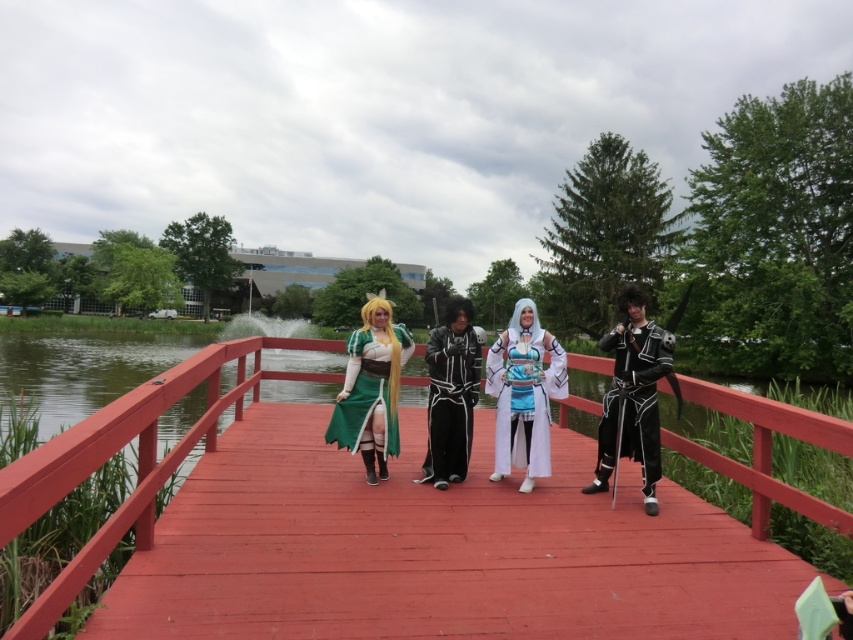
Is white glossy kimono at center taller than black satin robe at center?

Yes.

Describe the element at coordinates (523, 394) in the screenshot. I see `white glossy kimono at center` at that location.

Which is behind, point (519, 374) or point (451, 413)?

The point (451, 413) is more distant.

Image resolution: width=853 pixels, height=640 pixels. I want to click on white glossy kimono at center, so click(x=523, y=394).

Does point (579, 636) come behind point (517, 355)?

No, it is in front of (517, 355).

Is wooden bridge at center smaller than white glossy kimono at center?

Indeed, wooden bridge at center has a smaller size compared to white glossy kimono at center.

Describe the element at coordinates (148, 458) in the screenshot. The width and height of the screenshot is (853, 640). I see `wooden bridge at center` at that location.

Identify the location of wooden bridge at center. The image size is (853, 640). (148, 458).

You are a GUI agent. You are given a task and a screenshot of the screen. Output one action in this format:
    pyautogui.click(x=<x>, y=<y>)
    Task: Click on the wooden bridge at center
    The image size is (853, 640).
    Given the screenshot: What is the action you would take?
    pyautogui.click(x=148, y=458)